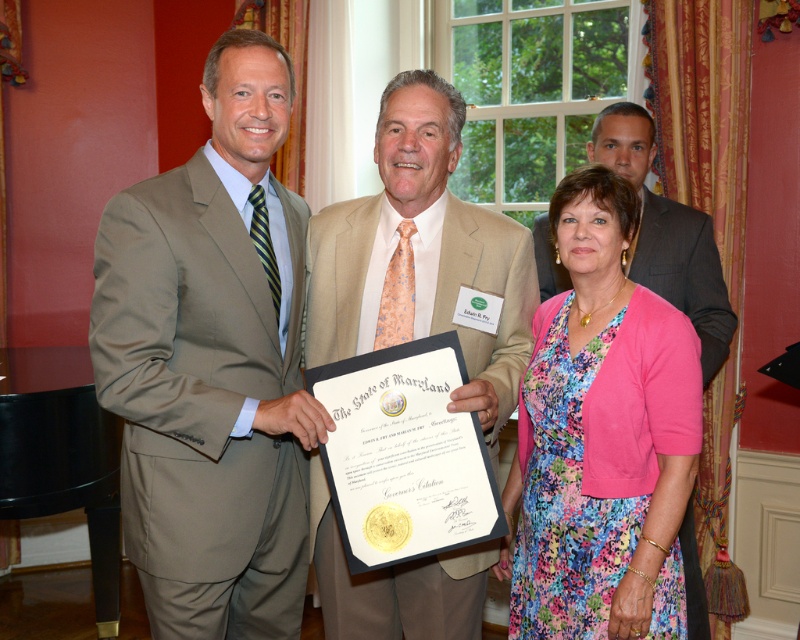
In the scene, there are two central figures wearing a floral dress at center and a light beige suit at center. Which piece of clothing is located lower in the image?

The floral dress at center is positioned under the light beige suit at center, so the floral dress at center is lower in the image.

You are observing a formal event where two individuals are wearing suits. The scene includes a satin tan suit at center and a light beige suit at center. Which suit is covering part of the other one?

The satin tan suit at center is positioned over the light beige suit at center, so it is covering part of the light beige suit at center.